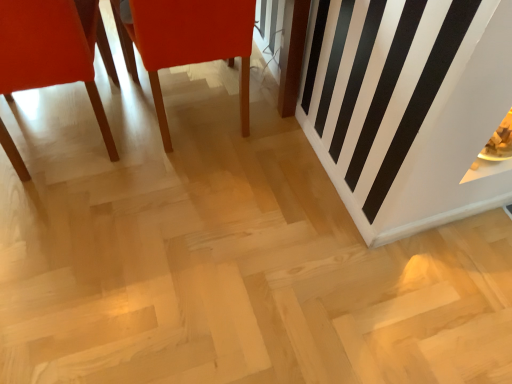
Question: Is matte wood chair at center, the 1th chair viewed from the right, to the left or to the right of matte orange chair at left, the 1th chair viewed from the left, in the image?

Choices:
 (A) left
 (B) right

Answer: (B)

Question: Considering the positions of matte wood chair at center, which is counted as the second chair, starting from the left, and matte orange chair at left, which is the second chair in right-to-left order, in the image, is matte wood chair at center, which is counted as the second chair, starting from the left, wider or thinner than matte orange chair at left, which is the second chair in right-to-left order,?

Choices:
 (A) thin
 (B) wide

Answer: (B)

Question: In the image, is matte wood chair at center, the 1th chair viewed from the right, positioned in front of or behind matte orange chair at left, which is the second chair in right-to-left order?

Choices:
 (A) behind
 (B) front

Answer: (A)

Question: From the image's perspective, is matte orange chair at left, the 1th chair viewed from the left, above or below matte wood chair at center, the 1th chair viewed from the right?

Choices:
 (A) above
 (B) below

Answer: (B)

Question: From a real-world perspective, is matte orange chair at left, the 1th chair viewed from the left, positioned above or below matte wood chair at center, which is counted as the second chair, starting from the left?

Choices:
 (A) below
 (B) above

Answer: (B)

Question: Considering the positions of matte orange chair at left, which is the second chair in right-to-left order, and matte wood chair at center, the 1th chair viewed from the right, in the image, is matte orange chair at left, which is the second chair in right-to-left order, taller or shorter than matte wood chair at center, the 1th chair viewed from the right,?

Choices:
 (A) tall
 (B) short

Answer: (A)

Question: Is matte orange chair at left, which is the second chair in right-to-left order, situated inside matte wood chair at center, the 1th chair viewed from the right, or outside?

Choices:
 (A) outside
 (B) inside

Answer: (A)